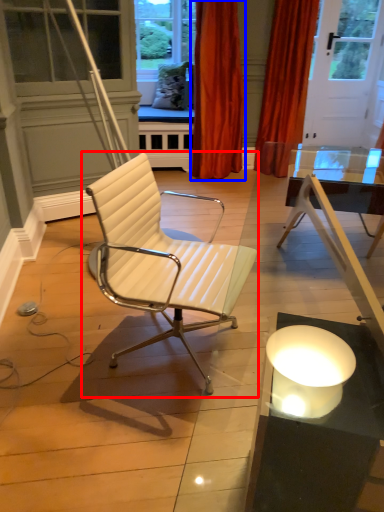
Question: Which of the following is the farthest to the observer, chair (highlighted by a red box) or curtain (highlighted by a blue box)?

Choices:
 (A) chair
 (B) curtain

Answer: (B)